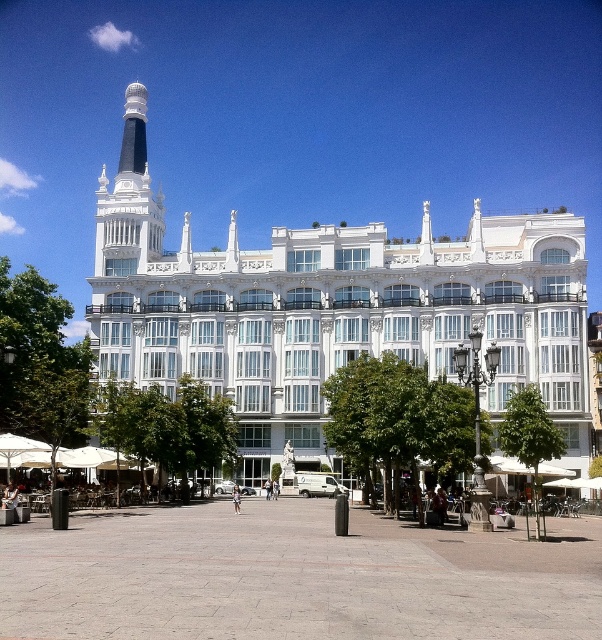
Can you confirm if white glossy building at center is bigger than white marble tower at upper center?

Yes.

Is white glossy building at center smaller than white marble tower at upper center?

Incorrect, white glossy building at center is not smaller in size than white marble tower at upper center.

The height and width of the screenshot is (640, 602). In order to click on white glossy building at center in this screenshot , I will do `click(330, 308)`.

At what (x,y) coordinates should I click in order to perform the action: click on white glossy building at center. Please return your answer as a coordinate pair (x, y). This screenshot has width=602, height=640. Looking at the image, I should click on (330, 308).